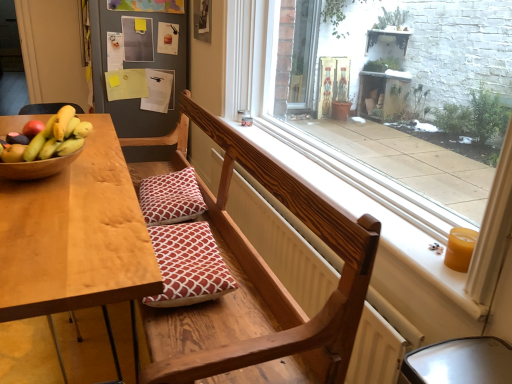
Question: From the image's perspective, is yellow wax candle at right located above or below wooden bench at center?

Choices:
 (A) above
 (B) below

Answer: (A)

Question: Would you say yellow wax candle at right is inside or outside wooden bench at center?

Choices:
 (A) inside
 (B) outside

Answer: (B)

Question: Which of these objects is positioned farthest from the wooden bench at center?

Choices:
 (A) wooden bowl at left
 (B) red cotton pillow at center, acting as the 1th pillow starting from the front
 (C) red printed cushion at center, placed as the 2th pillow when sorted from front to back
 (D) wooden radiator at center
 (E) transparent glass window at center

Answer: (A)

Question: Which object is positioned farthest from the shiny yellow bananas at table left?

Choices:
 (A) red cotton pillow at center, positioned as the 2th pillow in back-to-front order
 (B) yellow wax candle at right
 (C) transparent glass window at center
 (D) wooden radiator at center
 (E) red printed cushion at center, which is counted as the first pillow, starting from the back

Answer: (B)